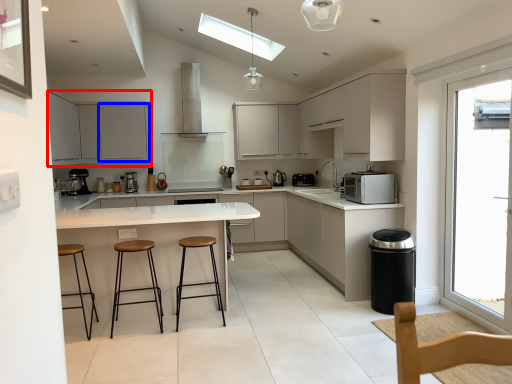
Question: Which of the following is the farthest to the observer, cabinetry (highlighted by a red box) or cabinetry (highlighted by a blue box)?

Choices:
 (A) cabinetry
 (B) cabinetry

Answer: (B)